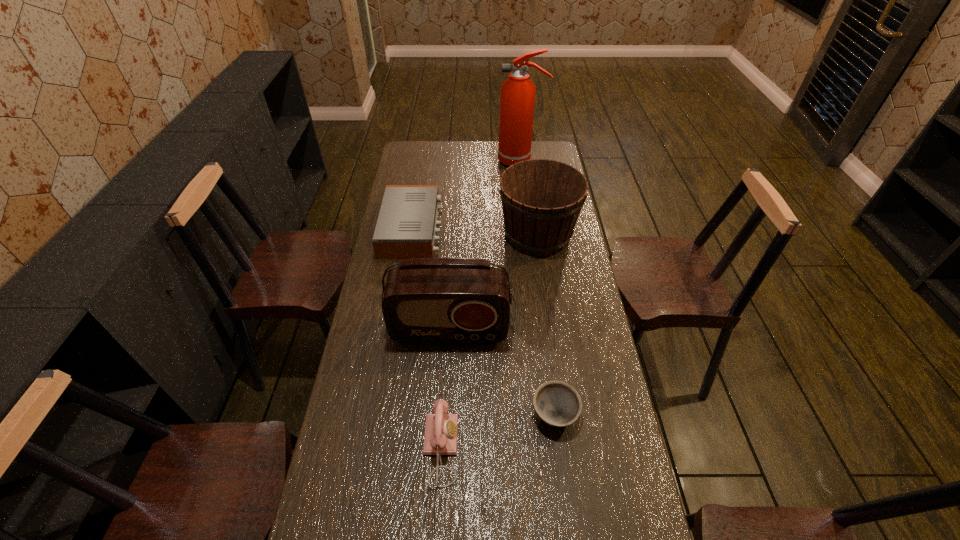
This screenshot has width=960, height=540. What are the coordinates of `vacant space located 0.190m at the nozzle of the farthest object` in the screenshot? It's located at (459, 161).

This screenshot has width=960, height=540. Identify the location of free space located 0.260m at the nozzle of the farthest object. (444, 161).

Where is `free space located on the front panel of the fifth shortest object`? free space located on the front panel of the fifth shortest object is located at coordinates (447, 364).

What are the coordinates of `free space located 0.210m on the front of the third tallest object` in the screenshot? It's located at (547, 305).

This screenshot has height=540, width=960. Identify the location of vacant space located 0.250m on the dial of the fourth tallest object. (552, 448).

Identify the location of vacant region located on the control panel of the farther radio receiver. (499, 229).

Locate an element on the screen. This screenshot has height=540, width=960. free region located 0.390m on the left of the shortest object is located at coordinates (392, 414).

The width and height of the screenshot is (960, 540). Identify the location of object situated at the far edge. (517, 102).

You are a GUI agent. You are given a task and a screenshot of the screen. Output one action in this format:
    pyautogui.click(x=<x>, y=<y>)
    Task: Click on the fire extinguisher that is at the right edge
    
    Given the screenshot: What is the action you would take?
    pyautogui.click(x=517, y=102)

I want to click on wine bucket at the right edge, so click(541, 199).